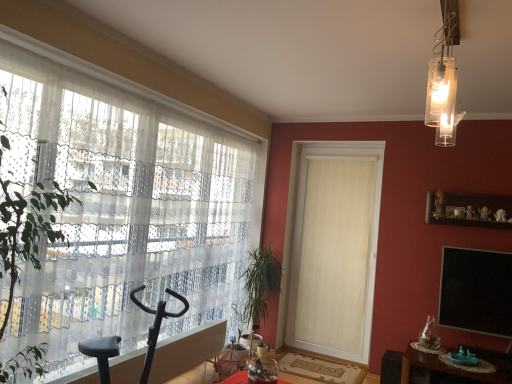
Question: Relative to black matte screen at upper right, is green leafy plant at left in front or behind?

Choices:
 (A) behind
 (B) front

Answer: (B)

Question: From the image's perspective, is green leafy plant at left above or below black matte screen at upper right?

Choices:
 (A) above
 (B) below

Answer: (A)

Question: Which is nearer to the white textured radiator at lower left?

Choices:
 (A) clear glass pendant light at upper right
 (B) wooden shelf at upper right
 (C) white textured door at center
 (D) white sheer curtain at left
 (E) black matte screen at upper right

Answer: (D)

Question: Which object is the farthest from the wooden shelf at upper right?

Choices:
 (A) white sheer curtain at left
 (B) wooden tray at lower right
 (C) white textured radiator at lower left
 (D) white textured door at center
 (E) black matte screen at upper right

Answer: (A)